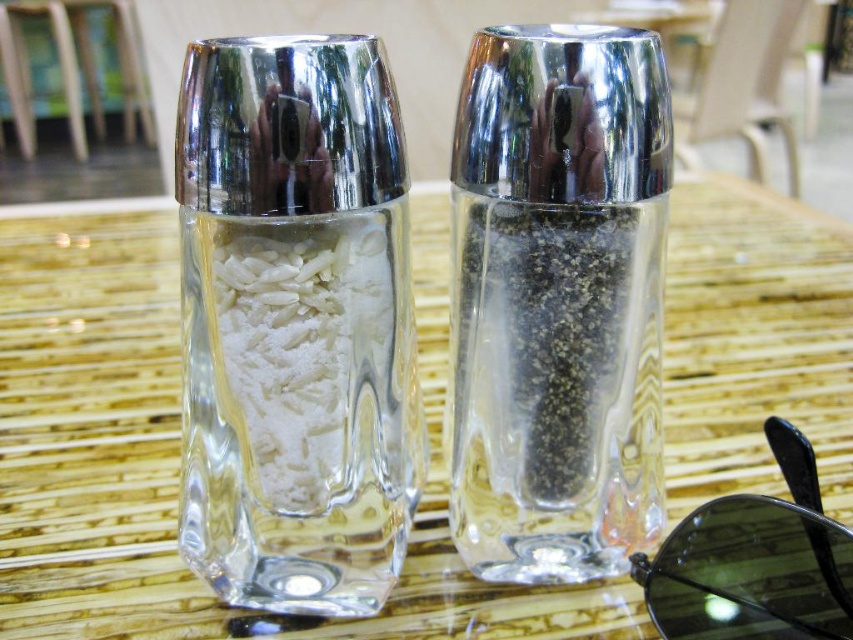
Looking at this image, is clear glass pepper grinder at right taller than white matte rice at center?

Correct, clear glass pepper grinder at right is much taller as white matte rice at center.

Is point (577, 332) less distant than point (204, 296)?

No, it is behind (204, 296).

Find the location of a particular element. clear glass pepper grinder at right is located at coordinates [556, 300].

The image size is (853, 640). Find the location of `clear glass pepper grinder at right`. clear glass pepper grinder at right is located at coordinates (556, 300).

Which is behind, point (142, 545) or point (663, 544)?

Positioned behind is point (142, 545).

Does clear glass table at center have a lesser width compared to black plastic sunglasses at lower right?

In fact, clear glass table at center might be wider than black plastic sunglasses at lower right.

Is point (148, 369) less distant than point (756, 529)?

No, it is not.

Locate an element on the screen. The image size is (853, 640). clear glass table at center is located at coordinates (178, 458).

Does clear glass table at center appear on the left side of clear glass pepper grinder at right?

Indeed, clear glass table at center is positioned on the left side of clear glass pepper grinder at right.

Can you confirm if clear glass table at center is positioned below clear glass pepper grinder at right?

Correct, clear glass table at center is located below clear glass pepper grinder at right.

At what (x,y) coordinates should I click in order to perform the action: click on clear glass table at center. Please return your answer as a coordinate pair (x, y). Looking at the image, I should click on (178, 458).

What are the coordinates of `clear glass table at center` in the screenshot? It's located at (178, 458).